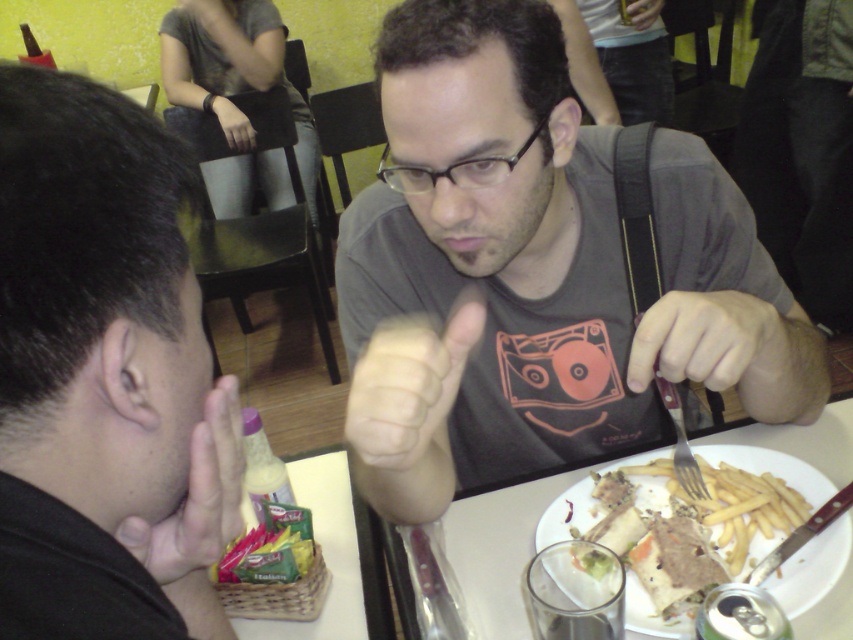
Does matte plastic plate at center have a lesser width compared to smooth skin hand at lower left?

Incorrect, matte plastic plate at center's width is not less than smooth skin hand at lower left's.

Between matte plastic plate at center and smooth skin hand at lower left, which one appears on the right side from the viewer's perspective?

matte plastic plate at center is more to the right.

Who is more distant from viewer, (x=619, y=465) or (x=213, y=397)?

Positioned behind is point (x=619, y=465).

The height and width of the screenshot is (640, 853). What are the coordinates of `matte plastic plate at center` in the screenshot? It's located at (811, 570).

From the picture: Who is taller, metallic knife at right or silver metallic fork at upper right?

silver metallic fork at upper right

Measure the distance from metallic knife at right to silver metallic fork at upper right.

metallic knife at right and silver metallic fork at upper right are 4.21 inches apart from each other.

Identify the location of metallic knife at right. (715, 346).

Where is `metallic knife at right`? metallic knife at right is located at coordinates (715, 346).

Is smooth skin hand at lower left shorter than silver metallic fork at upper right?

Indeed, smooth skin hand at lower left has a lesser height compared to silver metallic fork at upper right.

Does smooth skin hand at lower left lie behind silver metallic fork at upper right?

No, it is in front of silver metallic fork at upper right.

In order to click on smooth skin hand at lower left in this screenshot , I will do `click(196, 496)`.